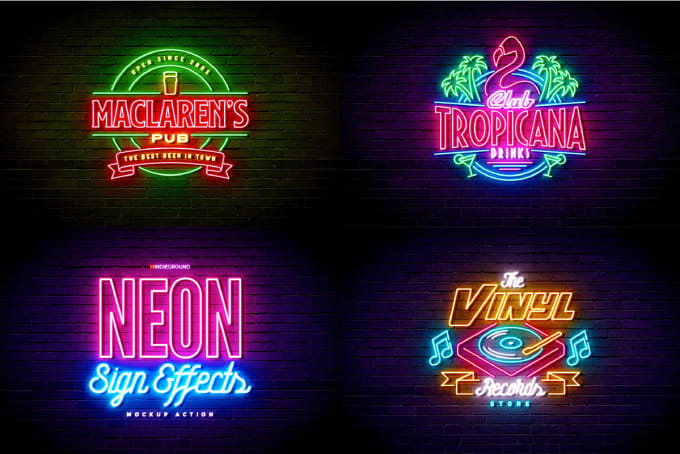
At what (x,y) coordinates should I click in order to perform the action: click on slight light emanating from neon signs onto wall. Please return your answer as a coordinate pair (x, y). Looking at the image, I should click on (71, 143), (71, 322), (260, 326), (265, 139), (419, 130), (613, 122), (413, 323), (623, 328).